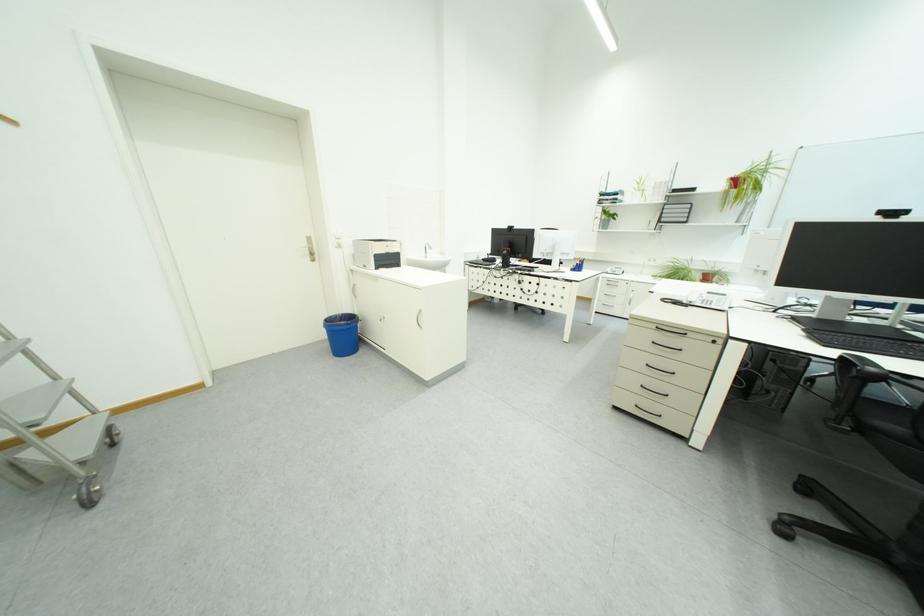
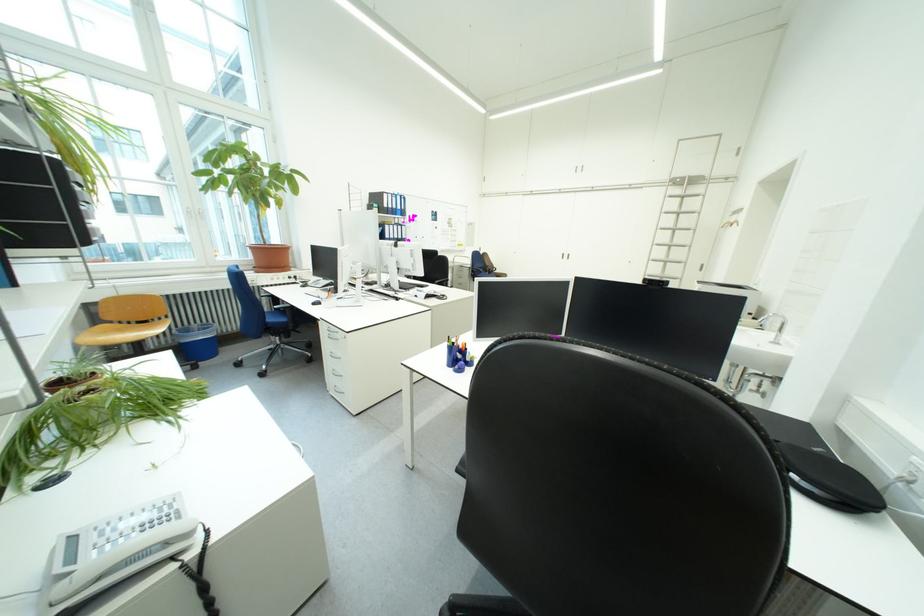
Question: I am providing you with two images of the same scene from different viewpoints. Which of the following objects are not visible in image2?

Choices:
 (A) scalloped table lamp
 (B) black webcam
 (C) blue trash bin
 (D) faucet handle

Answer: (B)